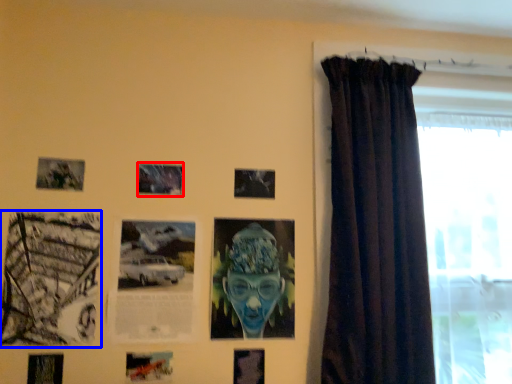
Question: Which object appears closest to the camera in this image, picture frame (highlighted by a red box) or picture frame (highlighted by a blue box)?

Choices:
 (A) picture frame
 (B) picture frame

Answer: (B)